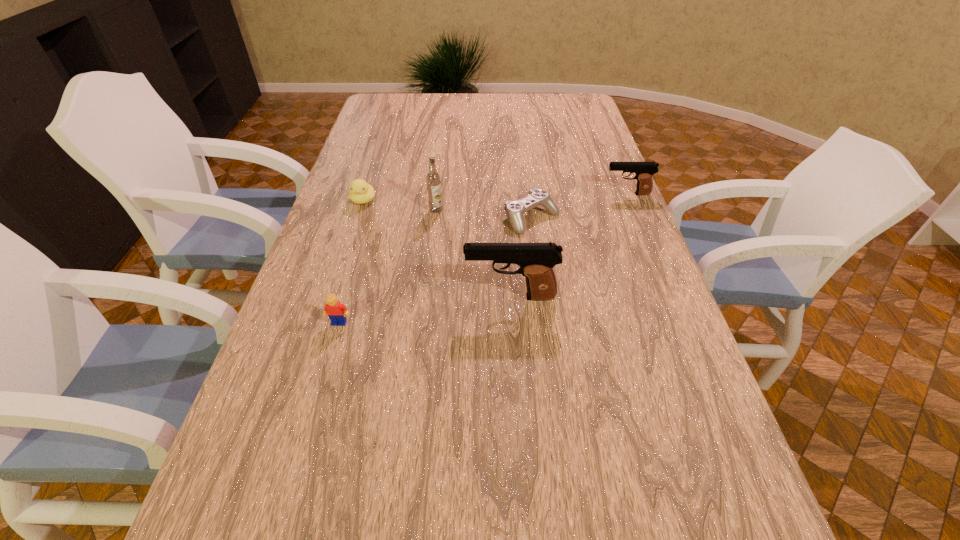
Identify the location of vacant space situated 0.150m at the barrel of the taller pistol. Image resolution: width=960 pixels, height=540 pixels. (404, 297).

The height and width of the screenshot is (540, 960). I want to click on free location located at the barrel of the rightmost object, so click(x=509, y=194).

I want to click on vacant space located at the barrel of the rightmost object, so click(x=481, y=194).

This screenshot has width=960, height=540. I want to click on free space located at the barrel of the rightmost object, so click(x=522, y=194).

You are a GUI agent. You are given a task and a screenshot of the screen. Output one action in this format:
    pyautogui.click(x=<x>, y=<y>)
    Task: Click on the vacant region located on the face of the Lego
    
    Given the screenshot: What is the action you would take?
    pyautogui.click(x=307, y=433)

Identify the location of vacant space situated on the back of the control. [527, 180].

This screenshot has height=540, width=960. What are the coordinates of `free spot located at the beak of the second shortest object` in the screenshot? It's located at (352, 236).

Find the location of `vacant space situated 0.110m on the label of the vodka`. vacant space situated 0.110m on the label of the vodka is located at coordinates (433, 238).

Where is `Lego that is at the left edge`? Lego that is at the left edge is located at coordinates (337, 312).

What are the coordinates of `duckling that is at the left edge` in the screenshot? It's located at coord(361,192).